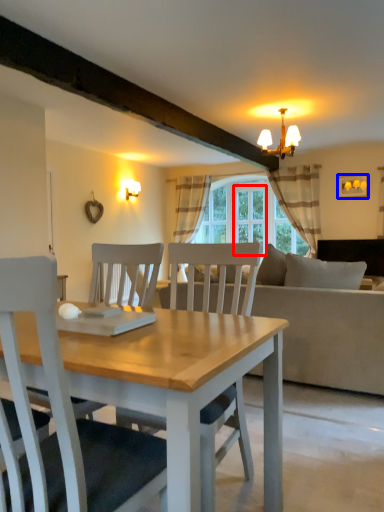
Question: Which of the following is the farthest to the observer, glass door (highlighted by a red box) or picture frame (highlighted by a blue box)?

Choices:
 (A) glass door
 (B) picture frame

Answer: (A)